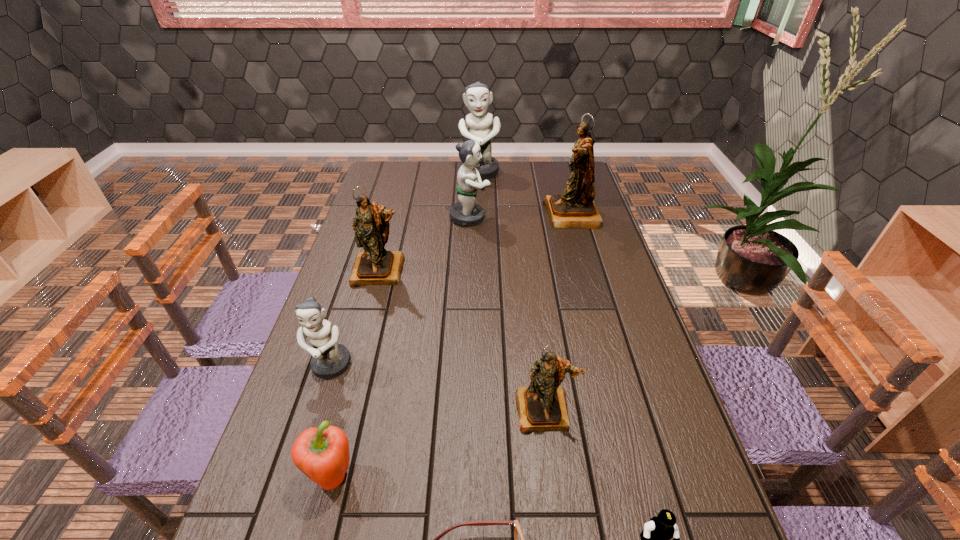
This screenshot has width=960, height=540. Find the location of `vacant space located 0.140m on the front-facing side of the leftmost green figurine`. vacant space located 0.140m on the front-facing side of the leftmost green figurine is located at coordinates [308, 438].

You are a GUI agent. You are given a task and a screenshot of the screen. Output one action in this format:
    pyautogui.click(x=<x>, y=<y>)
    Task: Click on the free space located on the right of the third shortest object
    
    Given the screenshot: What is the action you would take?
    pyautogui.click(x=438, y=477)

This screenshot has width=960, height=540. I want to click on object located in the far edge section of the desktop, so click(x=477, y=97).

This screenshot has width=960, height=540. Find the location of `pepper located at the left edge`. pepper located at the left edge is located at coordinates (322, 454).

I want to click on object present at the right edge, so click(575, 208).

The height and width of the screenshot is (540, 960). In order to click on free location at the far edge of the desktop in this screenshot , I will do `click(492, 178)`.

At what (x,y) coordinates should I click in order to perform the action: click on blank space at the left edge of the desktop. Please return your answer as a coordinate pair (x, y). Looking at the image, I should click on (387, 245).

The image size is (960, 540). Find the location of `free location at the right edge of the desktop`. free location at the right edge of the desktop is located at coordinates (633, 332).

Identify the location of vacant space at the far left corner of the desktop. This screenshot has height=540, width=960. (383, 176).

You are a GUI agent. You are given a task and a screenshot of the screen. Output one action in this format:
    pyautogui.click(x=<x>, y=<y>)
    Task: Click on the vacant space at the far right corner of the desktop
    Image resolution: width=960 pixels, height=540 pixels.
    Given the screenshot: What is the action you would take?
    pyautogui.click(x=555, y=173)